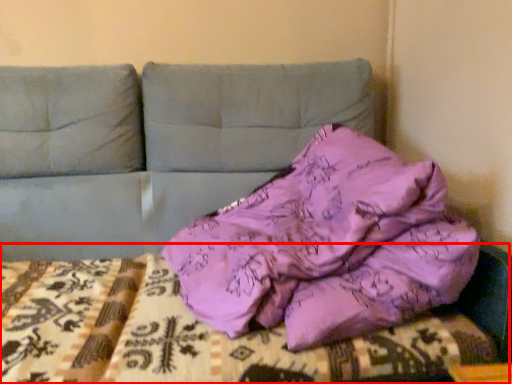
Question: From the image's perspective, where is bed frame (annotated by the red box) located in relation to pillow in the image?

Choices:
 (A) above
 (B) below

Answer: (B)